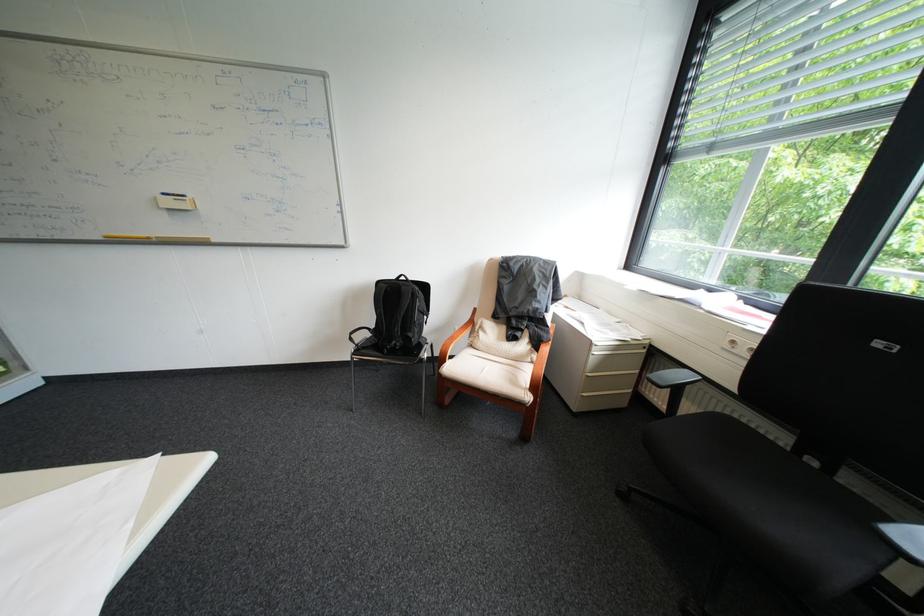
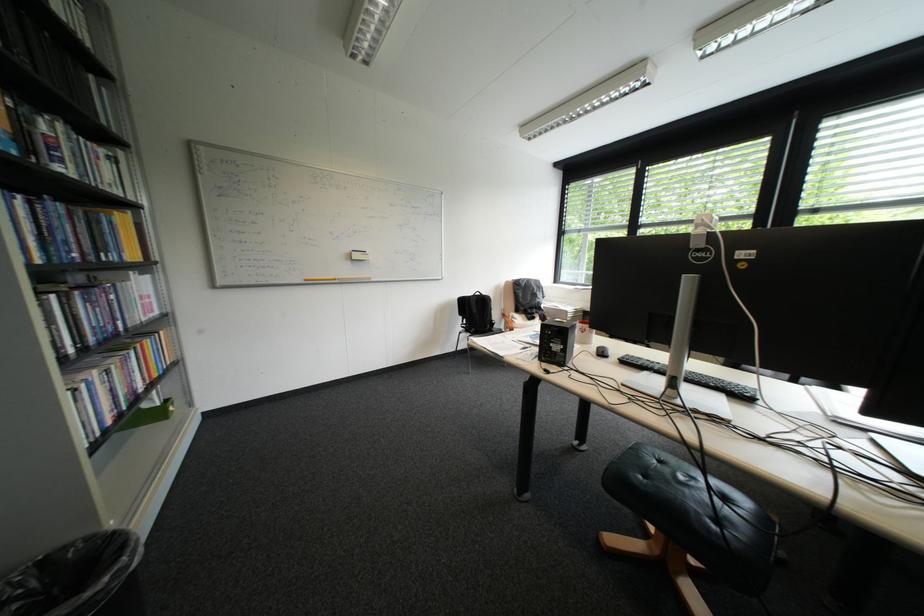
In a continuous first-person perspective shot, in which direction is the camera moving?

→ The cameraman walked toward left, backward.